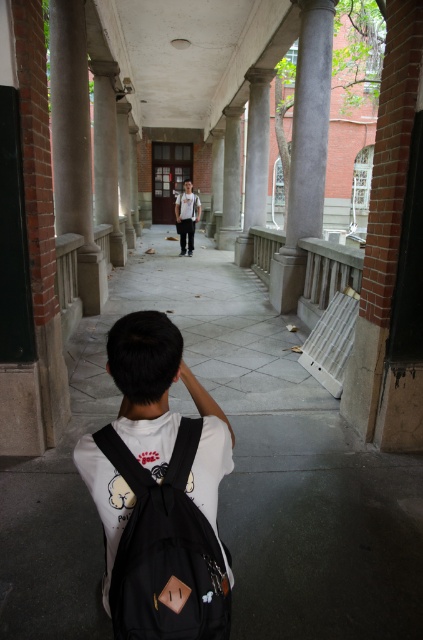
Question: Which object appears closest to the camera in this image?

Choices:
 (A) black matte backpack at lower center
 (B) smooth gray column at center
 (C) white cotton shirt at center

Answer: (A)

Question: Which object is positioned farthest from the smooth gray column at center?

Choices:
 (A) black matte backpack at lower center
 (B) white cotton shirt at center

Answer: (A)

Question: Is smooth gray column at center to the left of white cotton shirt at center from the viewer's perspective?

Choices:
 (A) no
 (B) yes

Answer: (A)

Question: Is black matte backpack at lower center smaller than white cotton shirt at center?

Choices:
 (A) yes
 (B) no

Answer: (A)

Question: Which object is farther from the camera taking this photo?

Choices:
 (A) black matte backpack at lower center
 (B) white cotton shirt at center
 (C) smooth gray column at center

Answer: (B)

Question: Is black matte backpack at lower center thinner than smooth gray column at center?

Choices:
 (A) yes
 (B) no

Answer: (A)